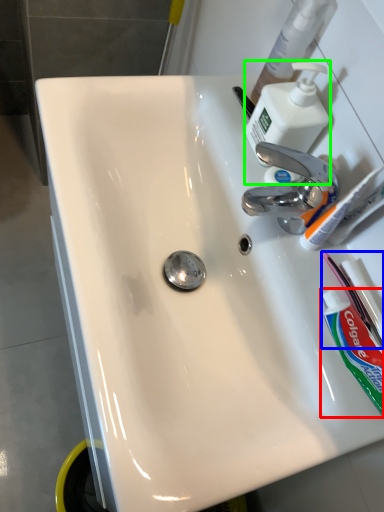
Question: Which object is the closest to the toothpaste (highlighted by a red box)? Choose among these: toothbrush (highlighted by a blue box) or soap dispenser (highlighted by a green box).

Choices:
 (A) toothbrush
 (B) soap dispenser

Answer: (A)